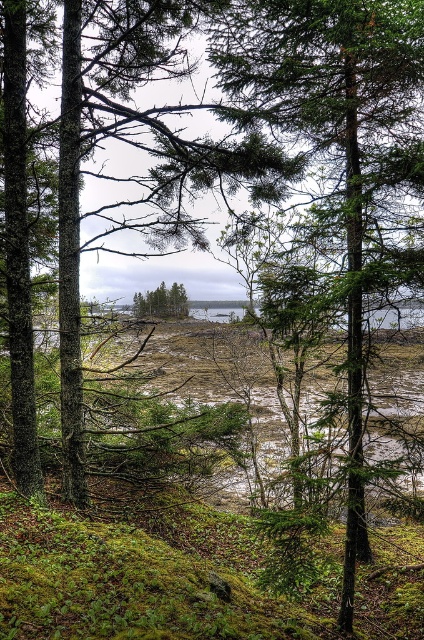
Question: Which point is closer to the camera?

Choices:
 (A) (153, 300)
 (B) (334, 26)

Answer: (B)

Question: Does green textured tree at center have a smaller size compared to green matte tree at center?

Choices:
 (A) yes
 (B) no

Answer: (B)

Question: Does green textured tree at center have a smaller size compared to green matte tree at center?

Choices:
 (A) yes
 (B) no

Answer: (B)

Question: In this image, where is green textured tree at center located relative to green matte tree at center?

Choices:
 (A) right
 (B) left

Answer: (A)

Question: Which object appears farthest from the camera in this image?

Choices:
 (A) green textured tree at center
 (B) green matte tree at center

Answer: (B)